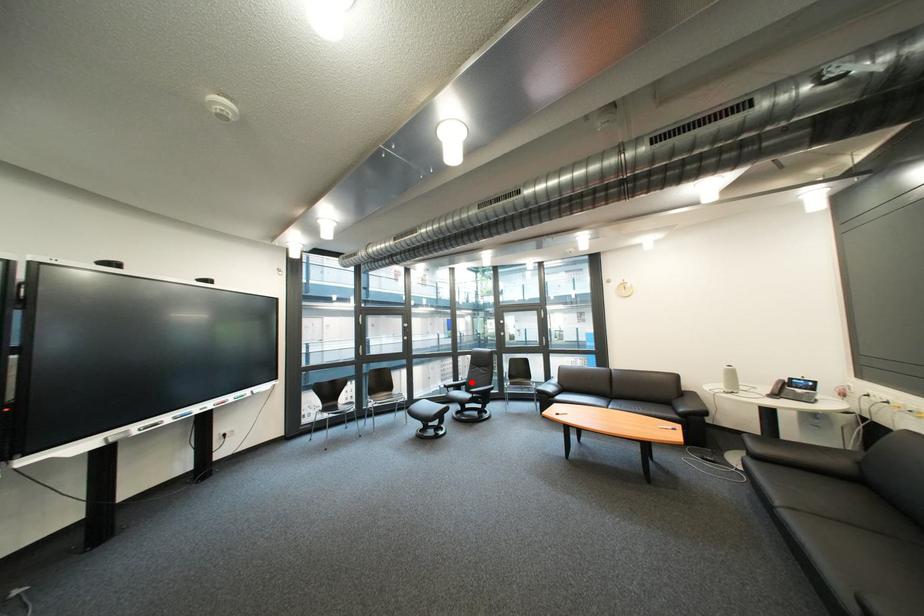
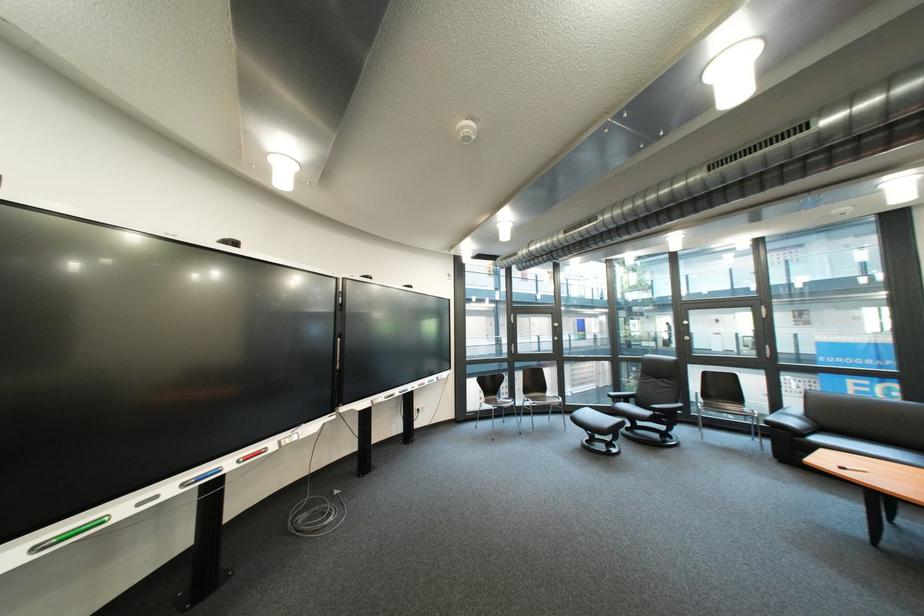
Find the pixel in the second image that matches the highlighted location in the first image.

(634, 392)